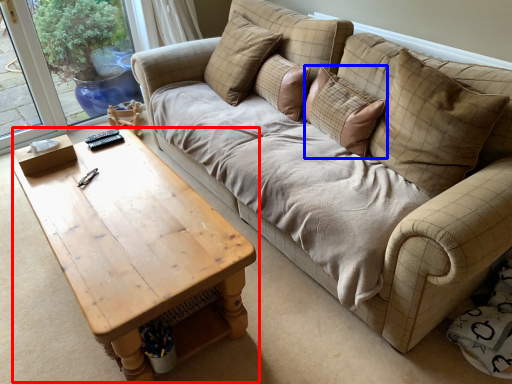
Question: Which object is further to the camera taking this photo, coffee table (highlighted by a red box) or pillow (highlighted by a blue box)?

Choices:
 (A) coffee table
 (B) pillow

Answer: (B)